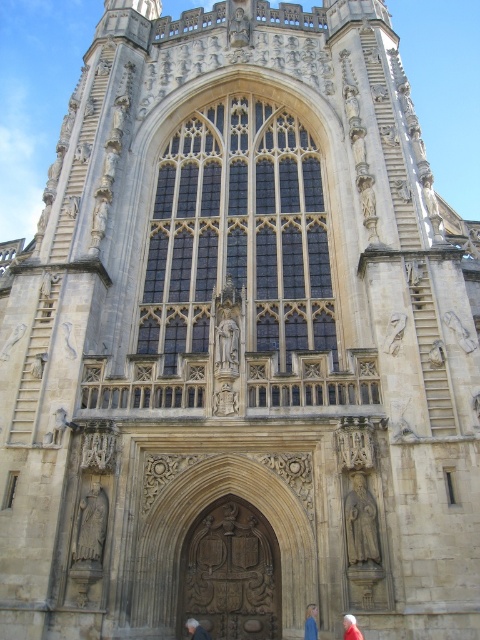
Question: Which point is closer to the camera?

Choices:
 (A) red fabric person at lower right
 (B) light brown leather jacket at lower center
 (C) carved stone door at center
 (D) blonde hair at lower center

Answer: (A)

Question: Can you confirm if blonde hair at lower center is positioned to the left of red fabric person at lower right?

Choices:
 (A) yes
 (B) no

Answer: (A)

Question: Is blonde hair at lower center wider than red fabric person at lower right?

Choices:
 (A) no
 (B) yes

Answer: (A)

Question: Which point appears closest to the camera in this image?

Choices:
 (A) [x=347, y=637]
 (B) [x=255, y=634]
 (C) [x=192, y=628]

Answer: (A)

Question: Which of the following is the closest to the observer?

Choices:
 (A) blonde hair at lower center
 (B) red fabric person at lower right

Answer: (B)

Question: Does carved stone door at center have a lesser width compared to red fabric person at lower right?

Choices:
 (A) yes
 (B) no

Answer: (B)